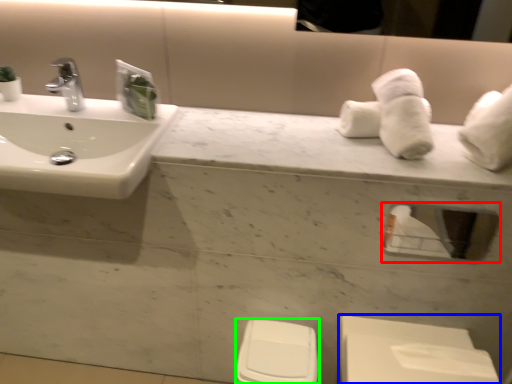
Question: Based on their relative distances, which object is farther from mirror (highlighted by a red box)? Choose from porcelain (highlighted by a blue box) and toilet bowl (highlighted by a green box).

Choices:
 (A) porcelain
 (B) toilet bowl

Answer: (B)